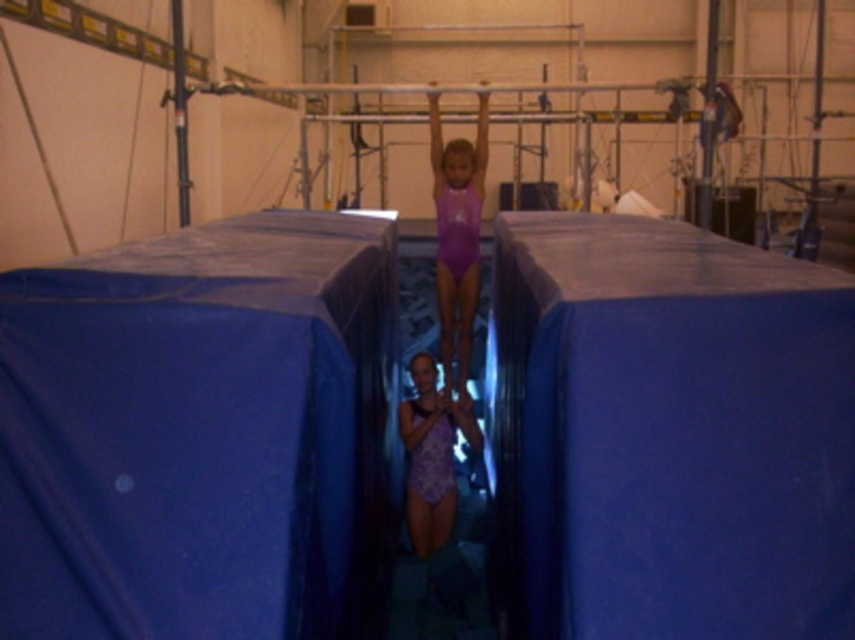
You are a gymnast preparing to land on the blue fabric mat at center during a routine. The point marked at coordinates (668,433) is where you need to aim. Is this point located on the blue fabric mat at center?

Yes, the point marked at coordinates (668,433) is located on the blue fabric mat at center as indicated in the description.

You are a gymnast preparing to land on the blue fabric mat at center after a routine. There is a purple matte swimsuit at center nearby. Can you safely land on the mat without touching the swimsuit?

The blue fabric mat at center has a larger size compared to the purple matte swimsuit at center, so yes, you can safely land on the mat without touching the swimsuit.

You are a gymnast preparing to land on the blue fabric mat at center while wearing the purple textured leotard at center. Considering their heights, will the mat provide a safe landing surface?

The blue fabric mat at center has a greater height compared to the purple textured leotard at center, so the mat is tall enough to absorb impact, providing a safe landing surface.